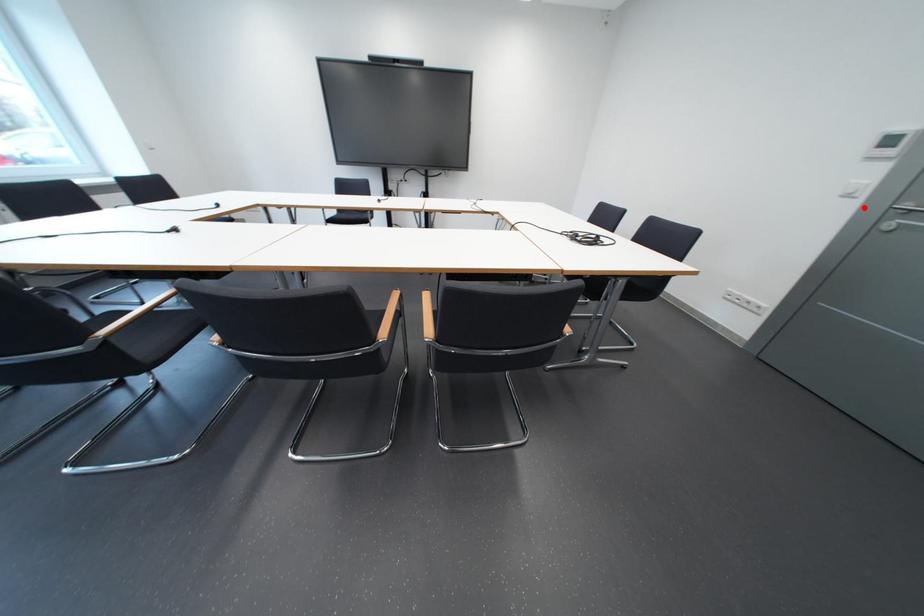
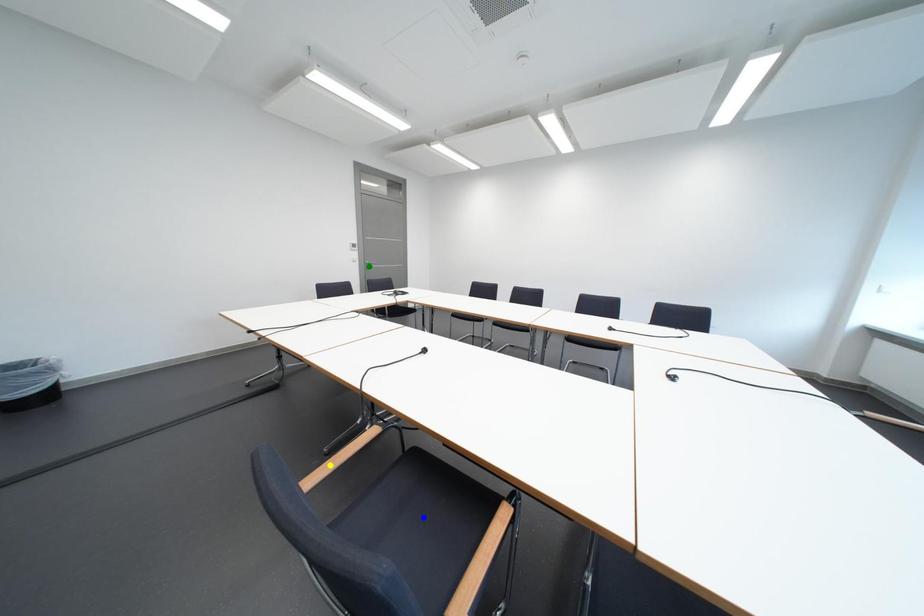
Question: I am providing you with two images of the same scene from different viewpoints. A red point is marked on the first image. You are given multiple points on the second image. Can you choose the point in image 2 that corresponds to the point in image 1?

Choices:
 (A) yellow point
 (B) green point
 (C) blue point

Answer: (B)